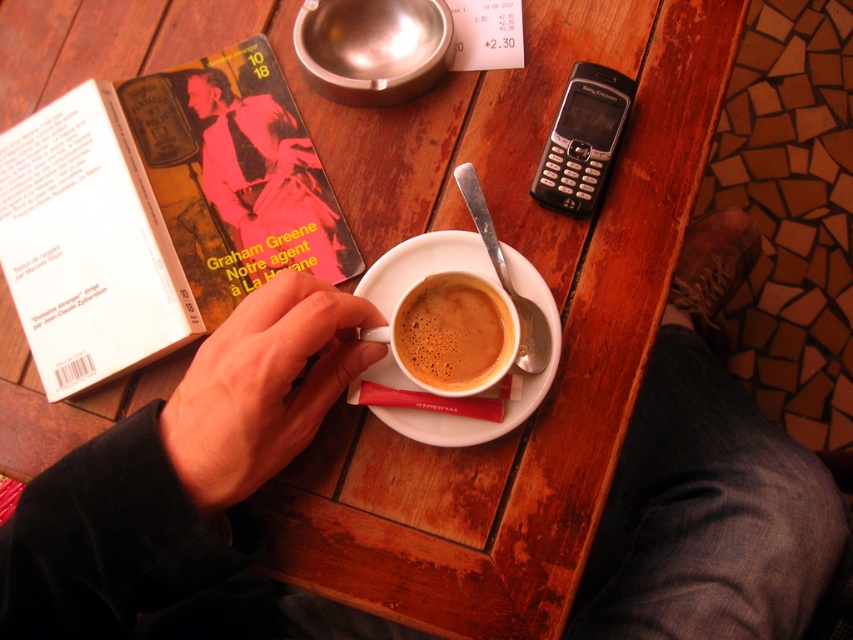
This screenshot has width=853, height=640. What do you see at coordinates (160, 211) in the screenshot?
I see `hardcover book at upper left` at bounding box center [160, 211].

Is hardcover book at upper left above white ceramic saucer at center?

Correct, hardcover book at upper left is located above white ceramic saucer at center.

Is point (289, 109) farther from camera compared to point (412, 273)?

Yes, it is.

Image resolution: width=853 pixels, height=640 pixels. Find the location of `hardcover book at upper left`. hardcover book at upper left is located at coordinates (160, 211).

Can you confirm if hardcover book at upper left is positioned to the left of matte ceramic cup at center?

Indeed, hardcover book at upper left is positioned on the left side of matte ceramic cup at center.

Who is higher up, hardcover book at upper left or matte ceramic cup at center?

hardcover book at upper left is above.

Between point (65, 225) and point (433, 358), which one is positioned in front?

Positioned in front is point (433, 358).

The height and width of the screenshot is (640, 853). Identify the location of hardcover book at upper left. (160, 211).

Between point (308, 342) and point (554, 148), which one is positioned behind?

Point (554, 148)

Who is taller, smooth skin hand at center or silver metallic phone at upper right?

smooth skin hand at center is taller.

Who is more distant from viewer, (305, 413) or (596, 134)?

Positioned behind is point (596, 134).

Where is `smooth skin hand at center`? smooth skin hand at center is located at coordinates (263, 387).